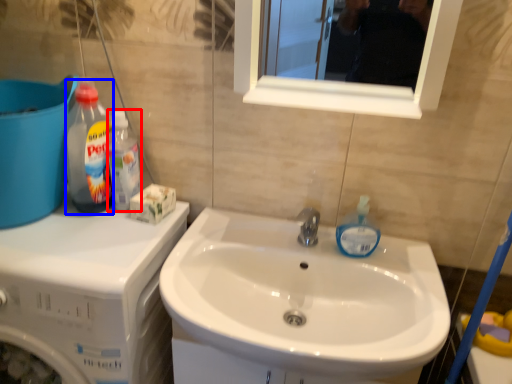
Question: Which of the following is the closest to the observer, cleaning product (highlighted by a red box) or cleaning product (highlighted by a blue box)?

Choices:
 (A) cleaning product
 (B) cleaning product

Answer: (B)